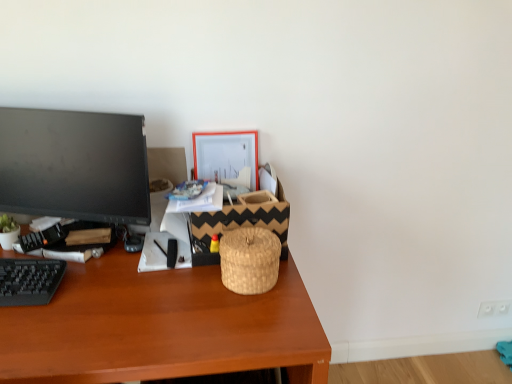
You are a GUI agent. You are given a task and a screenshot of the screen. Output one action in this format:
    pyautogui.click(x=<x>, y=<y>)
    Task: Click on the free space above brown wooden desk at center (from a real-world perspective)
    The image size is (512, 384).
    Given the screenshot: What is the action you would take?
    pyautogui.click(x=120, y=283)